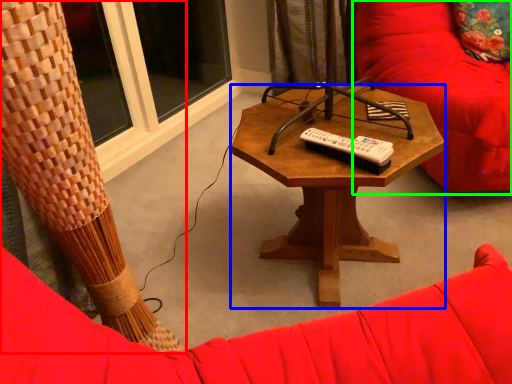
Question: Considering the real-world distances, which object is closest to curtain (highlighted by a red box)? coffee table (highlighted by a blue box) or swivel chair (highlighted by a green box).

Choices:
 (A) coffee table
 (B) swivel chair

Answer: (A)